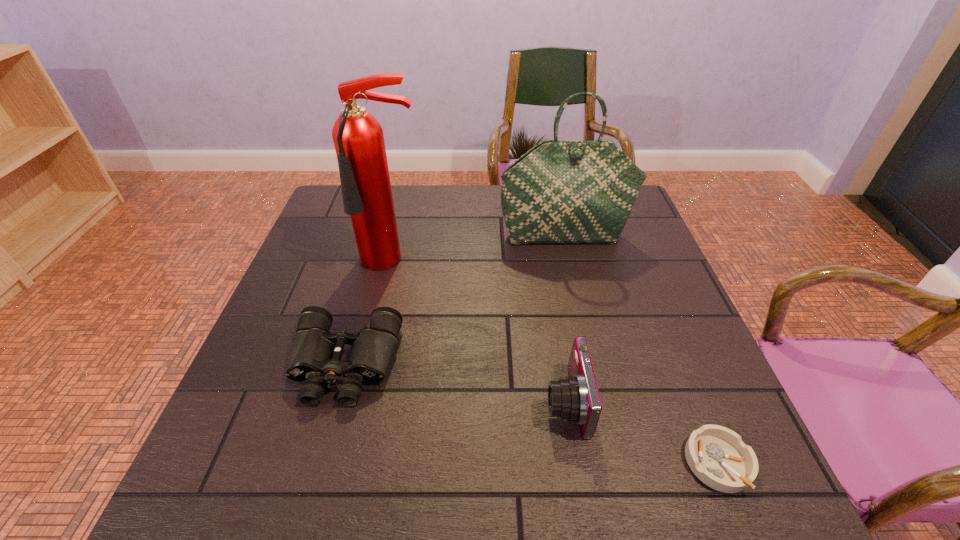
You are a GUI agent. You are given a task and a screenshot of the screen. Output one action in this format:
    pyautogui.click(x=<x>, y=<y>)
    Task: Click on the fire extinguisher
    Image resolution: width=960 pixels, height=540 pixels.
    Given the screenshot: What is the action you would take?
    pyautogui.click(x=358, y=138)

The height and width of the screenshot is (540, 960). I want to click on tote bag, so click(x=559, y=192).

You are a GUI agent. You are given a task and a screenshot of the screen. Output one action in this format:
    pyautogui.click(x=<x>, y=<y>)
    Task: Click on the camera
    The width and height of the screenshot is (960, 540).
    Given the screenshot: What is the action you would take?
    pyautogui.click(x=576, y=398)

At what (x,y) coordinates should I click in order to perform the action: click on the fourth tallest object. Please return your answer as a coordinate pair (x, y). Looking at the image, I should click on click(x=315, y=355).

Identify the location of the shortest object. (718, 457).

Locate an element on the screen. Image resolution: width=960 pixels, height=540 pixels. vacant region located 0.280m at the nozzle of the fire extinguisher is located at coordinates (368, 372).

This screenshot has height=540, width=960. Find the location of `vacant area situated on the left of the tote bag`. vacant area situated on the left of the tote bag is located at coordinates (402, 236).

You are a GUI agent. You are given a task and a screenshot of the screen. Output one action in this format:
    pyautogui.click(x=<x>, y=<y>)
    Task: Click on the free region located 0.150m on the front-facing side of the camera
    This screenshot has height=540, width=960.
    Given the screenshot: What is the action you would take?
    pyautogui.click(x=469, y=401)

You are a GUI agent. You are given a task and a screenshot of the screen. Output one action in this format:
    pyautogui.click(x=<x>, y=<y>)
    Task: Click on the vacant region located 0.200m on the front-facing side of the camera
    
    Given the screenshot: What is the action you would take?
    pyautogui.click(x=444, y=401)

Where is `vacant space located 0.170m on the front-facing side of the camera`? The image size is (960, 540). vacant space located 0.170m on the front-facing side of the camera is located at coordinates [x=460, y=401].